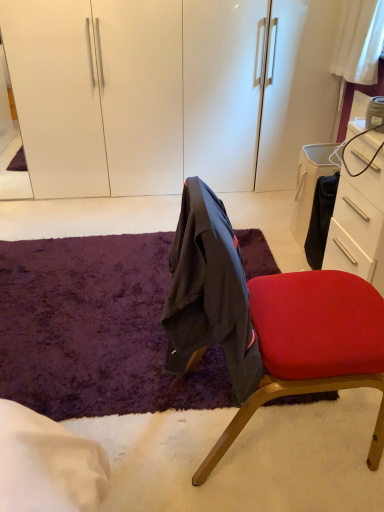
Question: Considering the positions of point (347, 211) and point (160, 335), is point (347, 211) closer or farther from the camera than point (160, 335)?

Choices:
 (A) farther
 (B) closer

Answer: (A)

Question: Visually, is white glossy drawer at right positioned to the left or to the right of purple shaggy rug at center?

Choices:
 (A) left
 (B) right

Answer: (B)

Question: Estimate the real-world distances between objects in this image. Which object is closer to the purple shaggy rug at center?

Choices:
 (A) white glossy drawer at right
 (B) velvet red chair at center

Answer: (B)

Question: Which of these objects is positioned closest to the white glossy drawer at right?

Choices:
 (A) velvet red chair at center
 (B) purple shaggy rug at center

Answer: (A)